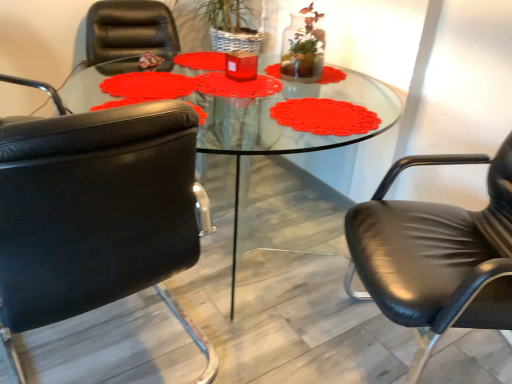
Question: Is transparent glass table at center wider or thinner than black leather chair at right, which is the 2th chair in left-to-right order?

Choices:
 (A) thin
 (B) wide

Answer: (B)

Question: From a real-world perspective, is transparent glass table at center above or below black leather chair at right, marked as the first chair in a right-to-left arrangement?

Choices:
 (A) above
 (B) below

Answer: (B)

Question: Which object is the closest to the black leather chair at left, the 2th chair in the right-to-left sequence?

Choices:
 (A) transparent glass table at center
 (B) black leather chair at right, which is the 2th chair in left-to-right order
 (C) translucent glass vase at upper center

Answer: (B)

Question: Estimate the real-world distances between objects in this image. Which object is farther from the translucent glass vase at upper center?

Choices:
 (A) black leather chair at left, the first chair from the left
 (B) transparent glass table at center
 (C) black leather chair at right, marked as the first chair in a right-to-left arrangement

Answer: (A)